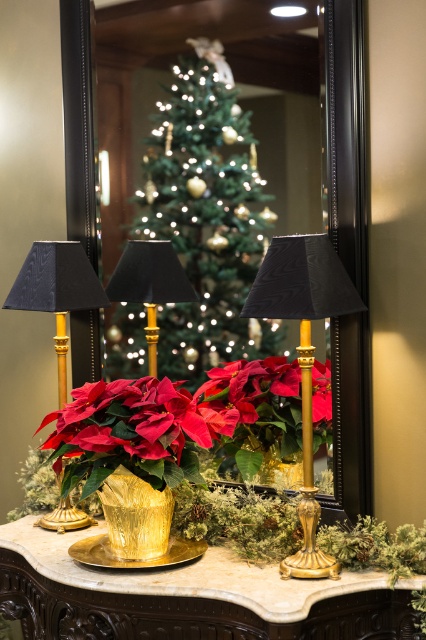
Does green textured christmas tree at center have a smaller size compared to matte gold pot at center?

No, green textured christmas tree at center is not smaller than matte gold pot at center.

Is green textured christmas tree at center taller than matte gold pot at center?

Indeed, green textured christmas tree at center has a greater height compared to matte gold pot at center.

Who is more forward, [192,150] or [88,428]?

Point [88,428] is in front.

The image size is (426, 640). I want to click on green textured christmas tree at center, so click(x=206, y=216).

Does matte gold pot at center have a smaller size compared to matte black lampshade at left?

Incorrect, matte gold pot at center is not smaller in size than matte black lampshade at left.

Does point (114, 401) lie behind point (29, 260)?

No, it is in front of (29, 260).

Is point (212, 397) farther from camera compared to point (28, 275)?

No, it is in front of (28, 275).

Find the location of a particular element. This screenshot has height=640, width=426. matte gold pot at center is located at coordinates (181, 419).

Which is in front, point (23, 534) or point (296, 349)?

Point (296, 349)

Does gold textured table at center appear over matte black lampshade at center?

Actually, gold textured table at center is below matte black lampshade at center.

In order to click on gold textured table at center in this screenshot , I will do `click(189, 596)`.

The width and height of the screenshot is (426, 640). I want to click on gold textured table at center, so click(x=189, y=596).